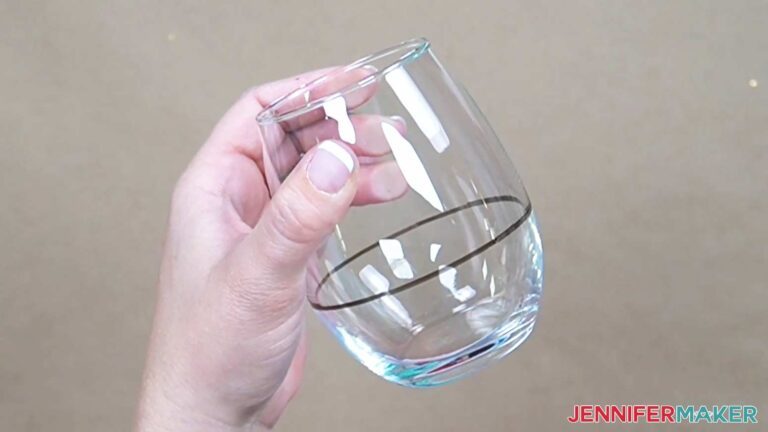
Where is `glass`? The image size is (768, 432). glass is located at coordinates (439, 173).